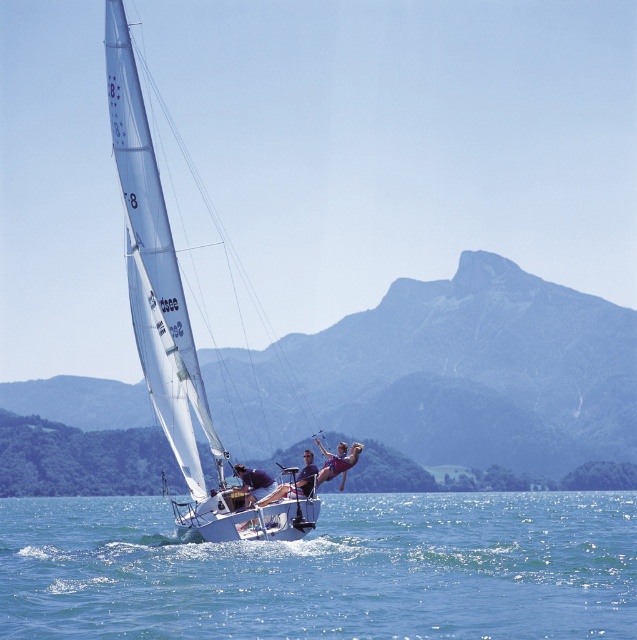
Question: In this image, where is clear blue water at center located relative to smooth brown hair at center?

Choices:
 (A) left
 (B) right

Answer: (B)

Question: Can you confirm if matte blue swimsuit at center is thinner than smooth brown hair at center?

Choices:
 (A) no
 (B) yes

Answer: (B)

Question: Is matte blue swimsuit at center positioned in front of purple fabric bikini at center?

Choices:
 (A) no
 (B) yes

Answer: (B)

Question: Which of these objects is positioned closest to the white matte sail at center?

Choices:
 (A) clear blue water at center
 (B) purple fabric bikini at center

Answer: (B)

Question: Which point is farther to the camera?

Choices:
 (A) (262, 499)
 (B) (320, 445)
 (C) (605, 534)

Answer: (C)

Question: Estimate the real-world distances between objects in this image. Which object is farther from the matte blue swimsuit at center?

Choices:
 (A) smooth brown hair at center
 (B) clear blue water at center
 (C) white matte sail at center

Answer: (B)